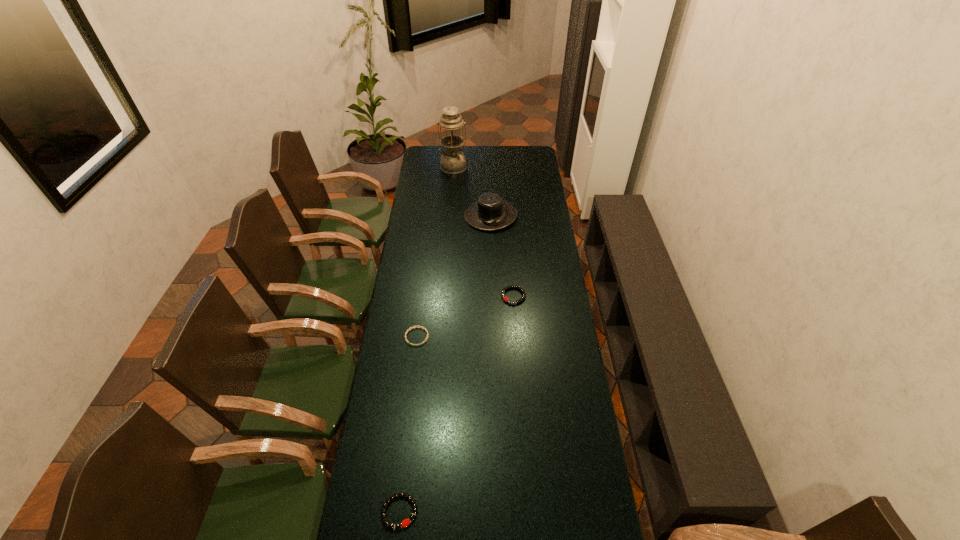
At what (x,y) coordinates should I click in order to perform the action: click on free space between the rightmost bracelet and the farthest object. Please return your answer as a coordinate pair (x, y). This screenshot has width=960, height=540. Looking at the image, I should click on (484, 232).

This screenshot has height=540, width=960. Find the location of `object that can be found as the closest to the nearest object`. object that can be found as the closest to the nearest object is located at coordinates pyautogui.click(x=413, y=326).

Locate which object ranks in proximity to the farthest object. Please provide its 2D coordinates. Your answer should be formatted as a tuple, i.e. [(x, y)], where the tuple contains the x and y coordinates of a point satisfying the conditions above.

[(490, 212)]

In order to click on the closest bracelet relative to the farthest object in this screenshot , I will do `click(523, 297)`.

In order to click on bracelet that is the third closest one to the dress hat in this screenshot , I will do `click(404, 523)`.

The image size is (960, 540). In order to click on vacant region that satisfies the following two spatial constraints: 1. on the front side of the oil lamp; 2. on the left side of the third nearest object in this screenshot , I will do `click(444, 296)`.

You are a GUI agent. You are given a task and a screenshot of the screen. Output one action in this format:
    pyautogui.click(x=<x>, y=<y>)
    Task: Click on the free space in the image that satisfies the following two spatial constraints: 1. on the front side of the second tallest object; 2. on the right side of the rightmost bracelet
    
    Given the screenshot: What is the action you would take?
    pyautogui.click(x=492, y=296)

The height and width of the screenshot is (540, 960). Find the location of `vacant area that satisfies the following two spatial constraints: 1. on the surface of the nearest bracelet showing star-shaped elements; 2. on the right side of the fourth farthest object`. vacant area that satisfies the following two spatial constraints: 1. on the surface of the nearest bracelet showing star-shaped elements; 2. on the right side of the fourth farthest object is located at coordinates tap(396, 511).

Identify the location of vacant area that satisfies the following two spatial constraints: 1. on the back side of the nearest object; 2. on the left side of the third farthest object. (424, 296).

Where is `vacant space that satisfies the following two spatial constraints: 1. on the surface of the nearest object showing star-shaped elements; 2. on the right side of the fourth farthest object`? The image size is (960, 540). vacant space that satisfies the following two spatial constraints: 1. on the surface of the nearest object showing star-shaped elements; 2. on the right side of the fourth farthest object is located at coordinates (396, 511).